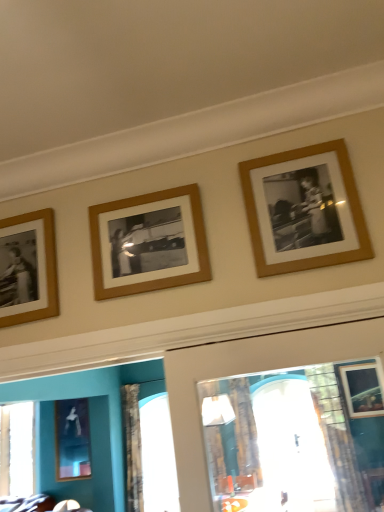
Question: Based on their sizes in the image, would you say metallic silver frame at lower left, the 1th picture frame in the bottom-to-top sequence, is bigger or smaller than wooden photo frame at left, placed as the second picture frame when sorted from back to front?

Choices:
 (A) small
 (B) big

Answer: (B)

Question: Is metallic silver frame at lower left, which is counted as the fourth picture frame, starting from the top, to the left or to the right of wooden photo frame at left, which is counted as the third picture frame, starting from the right, in the image?

Choices:
 (A) left
 (B) right

Answer: (A)

Question: Which of these objects is positioned farthest from the wooden photo frame at left, acting as the 2th picture frame starting from the left?

Choices:
 (A) metallic silver frame at lower left, which is counted as the fourth picture frame, starting from the top
 (B) wooden frame at center, placed as the 2th picture frame when sorted from top to bottom
 (C) wooden photo frame at upper right, which appears as the 1th picture frame when viewed from the top

Answer: (A)

Question: Which object is the closest to the wooden photo frame at upper right, marked as the fourth picture frame in a back-to-front arrangement?

Choices:
 (A) wooden photo frame at left, marked as the second picture frame in a bottom-to-top arrangement
 (B) wooden frame at center, which is the 2th picture frame in front-to-back order
 (C) metallic silver frame at lower left, acting as the fourth picture frame starting from the front

Answer: (B)